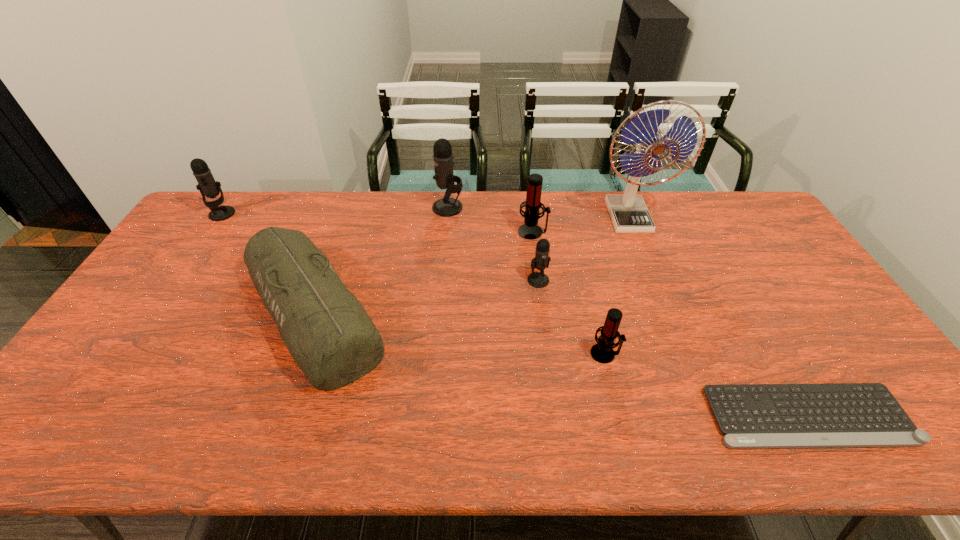
In the image, there is a desktop. Where is `vacant space at the far edge`? vacant space at the far edge is located at coordinates (319, 196).

This screenshot has height=540, width=960. Find the location of `blank space at the near edge of the desktop`. blank space at the near edge of the desktop is located at coordinates (326, 437).

I want to click on free region at the left edge, so click(165, 273).

At what (x,y) coordinates should I click in order to perform the action: click on free space at the right edge of the desktop. Please return your answer as a coordinate pair (x, y). This screenshot has width=960, height=540. Looking at the image, I should click on (762, 254).

Identify the location of unoccupied position between the second object from left to right and the blue fan. (471, 265).

I want to click on vacant space that's between the gray computer keyboard and the duffel bag, so click(561, 364).

Identify the location of vacant region between the rightmost microphone and the computer keyboard. This screenshot has height=540, width=960. (707, 385).

Locate an element on the screen. The height and width of the screenshot is (540, 960). empty space between the computer keyboard and the bigger red microphone is located at coordinates (670, 324).

The height and width of the screenshot is (540, 960). I want to click on empty space that is in between the leftmost object and the third farthest microphone, so click(377, 223).

The image size is (960, 540). Find the location of `unoccupied position between the shortest object and the duffel bag`. unoccupied position between the shortest object and the duffel bag is located at coordinates (561, 364).